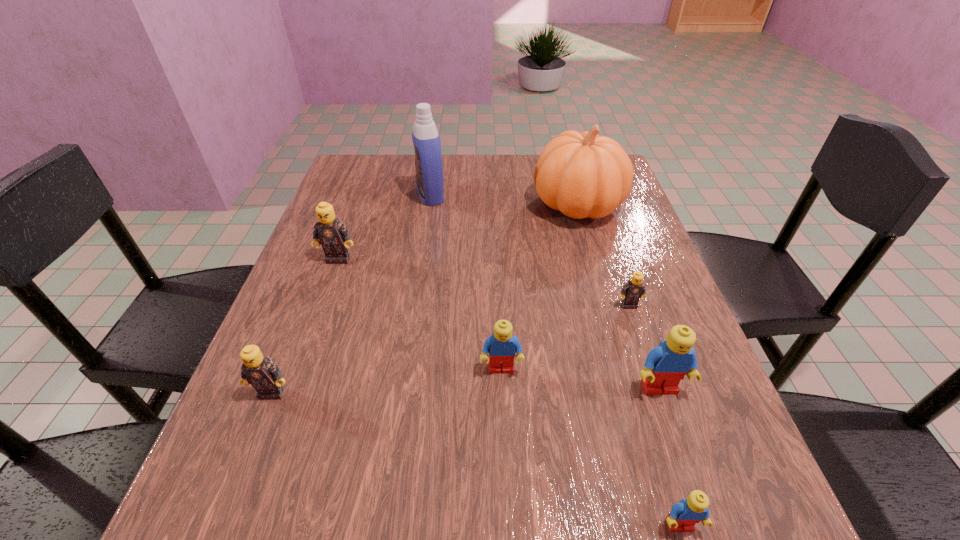
The width and height of the screenshot is (960, 540). Identify the location of detergent located at the far edge. (428, 159).

The height and width of the screenshot is (540, 960). In order to click on pumpkin that is at the far edge in this screenshot , I will do `click(582, 175)`.

Where is `object situated at the near edge`? The width and height of the screenshot is (960, 540). object situated at the near edge is located at coordinates (684, 515).

Identify the location of pumpkin that is positioned at the right edge. (582, 175).

Find the location of a particular element. This screenshot has width=960, height=540. object present at the far right corner is located at coordinates (582, 175).

Where is `object positioned at the near right corner`? The width and height of the screenshot is (960, 540). object positioned at the near right corner is located at coordinates (684, 515).

Where is `vacant space at the left edge of the desktop`? The image size is (960, 540). vacant space at the left edge of the desktop is located at coordinates (264, 455).

Locate an element on the screen. The width and height of the screenshot is (960, 540). vacant space at the right edge is located at coordinates (640, 452).

Find the location of `free spot at the far left corner of the desktop`. free spot at the far left corner of the desktop is located at coordinates (333, 190).

Locate an element on the screen. This screenshot has width=960, height=540. free space that is in between the second biggest tan Lego and the blue detergent is located at coordinates (351, 294).